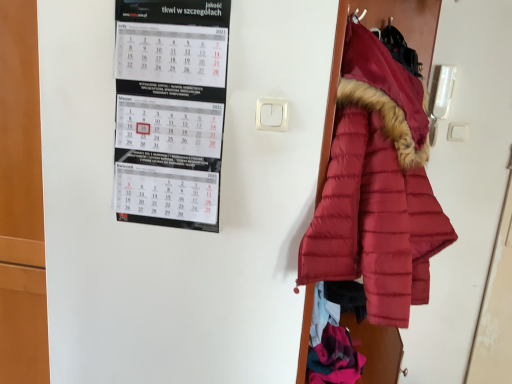
Question: Considering their positions, is white paper calendar at upper left located in front of or behind matte red puffer coat at right?

Choices:
 (A) front
 (B) behind

Answer: (B)

Question: From the image's perspective, is white paper calendar at upper left positioned above or below matte red puffer coat at right?

Choices:
 (A) below
 (B) above

Answer: (B)

Question: From their relative heights in the image, would you say white paper calendar at upper left is taller or shorter than matte red puffer coat at right?

Choices:
 (A) tall
 (B) short

Answer: (B)

Question: Is matte red puffer coat at right wider or thinner than white paper calendar at upper left?

Choices:
 (A) thin
 (B) wide

Answer: (B)

Question: From the image's perspective, is matte red puffer coat at right positioned above or below white paper calendar at upper left?

Choices:
 (A) below
 (B) above

Answer: (A)

Question: In terms of height, does matte red puffer coat at right look taller or shorter compared to white paper calendar at upper left?

Choices:
 (A) tall
 (B) short

Answer: (A)

Question: Based on their sizes in the image, would you say matte red puffer coat at right is bigger or smaller than white paper calendar at upper left?

Choices:
 (A) big
 (B) small

Answer: (A)